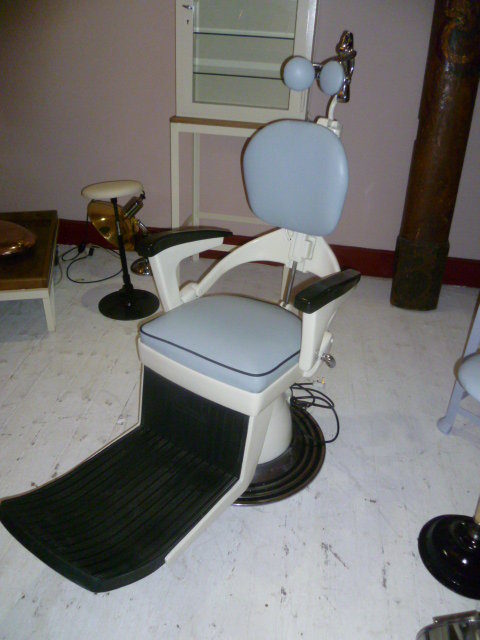
Where is `armrests`? The image size is (480, 640). armrests is located at coordinates (168, 244), (310, 296).